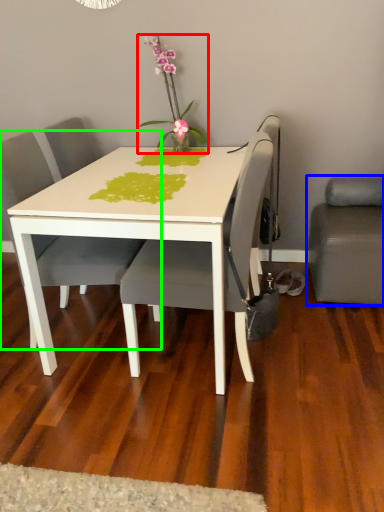
Question: Estimate the real-world distances between objects in this image. Which object is farther from houseplant (highlighted by a red box), studio couch (highlighted by a blue box) or chair (highlighted by a green box)?

Choices:
 (A) studio couch
 (B) chair

Answer: (A)